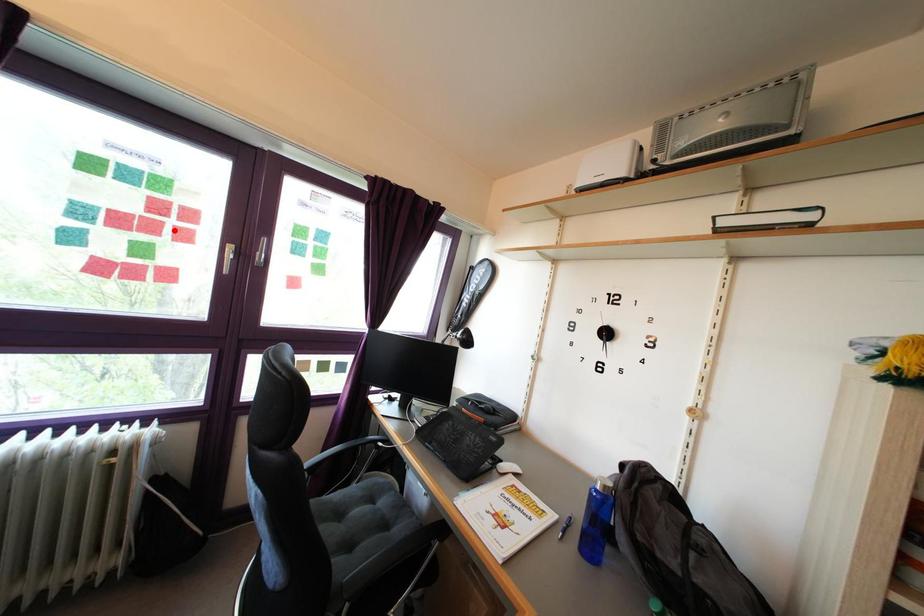
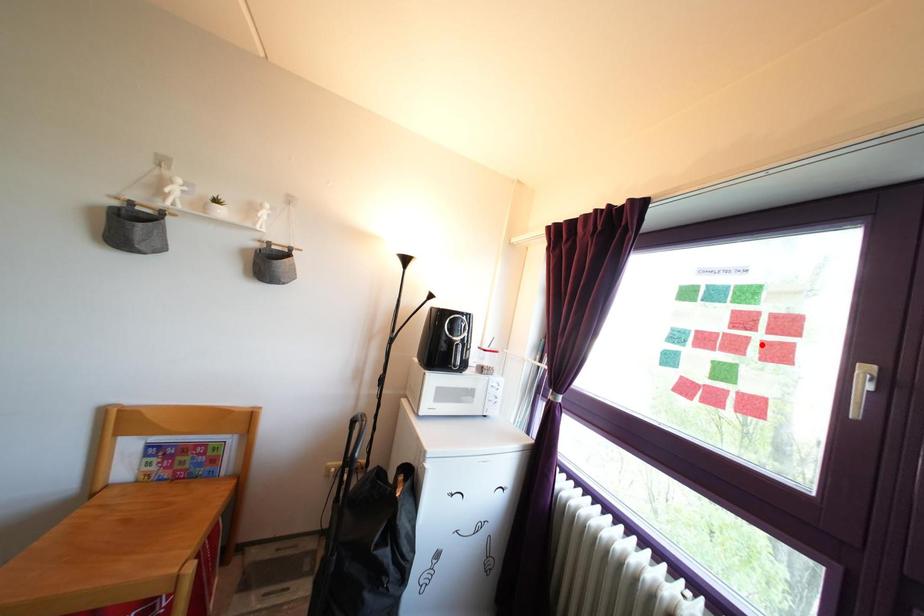
Looking at this image, I am providing you with two images of the same scene from different viewpoints. A red point is marked on the first image and another point is marked on the second image. Is the marked point in image1 the same physical position as the marked point in image2?

Yes